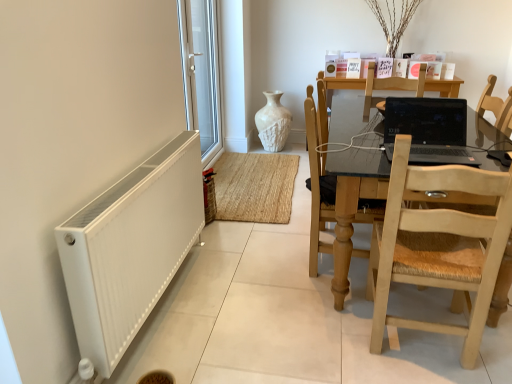
What do you see at coordinates (438, 247) in the screenshot? I see `light wood/rattan chair at right, positioned as the 2th chair in back-to-front order` at bounding box center [438, 247].

What do you see at coordinates (273, 122) in the screenshot?
I see `white textured vase at center` at bounding box center [273, 122].

This screenshot has width=512, height=384. I want to click on black glossy laptop at center, so click(429, 130).

At what (x,y) coordinates should I click in order to perform the action: click on light brown wooden chair at center, arranged as the 2th chair when viewed from the front. Please return your answer as a coordinate pair (x, y). Looking at the image, I should click on (318, 173).

From the image's perspective, is light wood/rattan chair at right, positioned as the 2th chair in back-to-front order, above or below light wood table at right?

light wood/rattan chair at right, positioned as the 2th chair in back-to-front order, is situated lower than light wood table at right in the image.

Consider the image. Considering the sizes of objects light wood/rattan chair at right, the first chair viewed from the front, and light wood table at right in the image provided, who is thinner, light wood/rattan chair at right, the first chair viewed from the front, or light wood table at right?

light wood/rattan chair at right, the first chair viewed from the front.

Could you tell me if light wood/rattan chair at right, the first chair viewed from the front, is facing light wood table at right?

Yes, light wood/rattan chair at right, the first chair viewed from the front, faces towards light wood table at right.

Considering the points (461, 158) and (329, 190), which point is behind, point (461, 158) or point (329, 190)?

The point (329, 190) is farther from the camera.

Would you say black glossy laptop at center contains light brown wooden chair at center, arranged as the 2th chair when viewed from the front?

No, light brown wooden chair at center, arranged as the 2th chair when viewed from the front, is not a part of black glossy laptop at center.

Considering the sizes of objects black glossy laptop at center and light brown wooden chair at center, the first chair from the back, in the image provided, who is shorter, black glossy laptop at center or light brown wooden chair at center, the first chair from the back,?

black glossy laptop at center is shorter.

Is light brown wooden chair at center, arranged as the 2th chair when viewed from the front, at the back of black glossy laptop at center?

black glossy laptop at center does not have its back to light brown wooden chair at center, arranged as the 2th chair when viewed from the front.

Between white textured vase at center and white plastic window at left, which one has larger width?

white textured vase at center.

Which is more to the left, white textured vase at center or white plastic window at left?

Positioned to the left is white plastic window at left.

Between white textured vase at center and white plastic window at left, which one has larger size?

With larger size is white plastic window at left.

Considering the positions of point (268, 120) and point (211, 52), is point (268, 120) closer or farther from the camera than point (211, 52)?

Point (268, 120) appears to be farther away from the viewer than point (211, 52).

Who is shorter, black glossy laptop at center or light wood table at right?

black glossy laptop at center is shorter.

Based on the photo, does black glossy laptop at center turn towards light wood table at right?

No, black glossy laptop at center is not oriented towards light wood table at right.

Between black glossy laptop at center and light wood table at right, which one appears on the left side from the viewer's perspective?

black glossy laptop at center is more to the left.

Is black glossy laptop at center placed right next to light wood table at right?

No.

The image size is (512, 384). In order to click on laptop that is on the right side of white plastic window at left in this screenshot , I will do `click(429, 130)`.

In the scene shown: Choose the correct answer: Is white plastic window at left inside black glossy laptop at center or outside it?

white plastic window at left cannot be found inside black glossy laptop at center.

Can you confirm if white plastic window at left is shorter than black glossy laptop at center?

No.

Could you tell me if white plastic window at left is facing black glossy laptop at center?

No, white plastic window at left is not turned towards black glossy laptop at center.

Can you confirm if light brown wooden chair at center, arranged as the 2th chair when viewed from the front, is shorter than light wood table at right?

No.

Is the surface of light brown wooden chair at center, arranged as the 2th chair when viewed from the front, in direct contact with light wood table at right?

No, light brown wooden chair at center, arranged as the 2th chair when viewed from the front, is not next to light wood table at right.

From a real-world perspective, is light brown wooden chair at center, arranged as the 2th chair when viewed from the front, below light wood table at right?

No, from a real-world perspective, light brown wooden chair at center, arranged as the 2th chair when viewed from the front, is not below light wood table at right.

Can you confirm if white textured vase at center is wider than black glossy laptop at center?

Incorrect, the width of white textured vase at center does not surpass that of black glossy laptop at center.

Can you tell me how much white textured vase at center and black glossy laptop at center differ in facing direction?

2.45 degrees separate the facing orientations of white textured vase at center and black glossy laptop at center.

Between white textured vase at center and black glossy laptop at center, which one appears on the left side from the viewer's perspective?

Positioned to the left is white textured vase at center.

Locate an element on the screen. kitchen & dining room table below the light wood/rattan chair at right, positioned as the 2th chair in back-to-front order (from a real-world perspective) is located at coordinates (351, 207).

Find the location of a particular element. The image size is (512, 384). chair behind the black glossy laptop at center is located at coordinates (318, 173).

Estimate the real-world distances between objects in this image. Which object is closer to white textured vase at center, black glossy laptop at center or light wood/rattan chair at right, positioned as the 2th chair in back-to-front order?

black glossy laptop at center lies closer to white textured vase at center than the other object.

From the image, which object appears to be farther from white plastic window at left, light wood/rattan chair at right, the first chair viewed from the front, or black glossy laptop at center?

light wood/rattan chair at right, the first chair viewed from the front, lies further to white plastic window at left than the other object.

From the image, which object appears to be farther from light brown wooden chair at center, the first chair from the back, white matte radiator at lower left or white plastic window at left?

Based on the image, white plastic window at left appears to be further to light brown wooden chair at center, the first chair from the back.

In the scene shown: When comparing their distances from light wood/rattan chair at right, positioned as the 2th chair in back-to-front order, does black glossy laptop at center or white plastic window at left seem further?

The object further to light wood/rattan chair at right, positioned as the 2th chair in back-to-front order, is white plastic window at left.

When comparing their distances from light wood table at right, does white textured vase at center or light brown wooden chair at center, arranged as the 2th chair when viewed from the front, seem closer?

Based on the image, light brown wooden chair at center, arranged as the 2th chair when viewed from the front, appears to be nearer to light wood table at right.

Considering their positions, is light wood/rattan chair at right, the first chair viewed from the front, positioned closer to white textured vase at center than black glossy laptop at center?

Based on the image, black glossy laptop at center appears to be nearer to white textured vase at center.

Which object lies nearer to the anchor point white textured vase at center, white matte radiator at lower left or black glossy laptop at center?

The object closer to white textured vase at center is black glossy laptop at center.

Considering their positions, is white matte radiator at lower left positioned closer to light brown wooden chair at center, the first chair from the back, than light wood table at right?

The object closer to light brown wooden chair at center, the first chair from the back, is light wood table at right.

Image resolution: width=512 pixels, height=384 pixels. I want to click on chair between light wood table at right and white plastic window at left along the z-axis, so click(318, 173).

The image size is (512, 384). I want to click on kitchen & dining room table positioned between white matte radiator at lower left and white plastic window at left from near to far, so coord(351,207).

You are a GUI agent. You are given a task and a screenshot of the screen. Output one action in this format:
    pyautogui.click(x=<x>, y=<y>)
    Task: Click on the window screen positioned between light wood/rattan chair at right, positioned as the 2th chair in back-to-front order, and white textured vase at center from near to far
    Image resolution: width=512 pixels, height=384 pixels.
    Given the screenshot: What is the action you would take?
    pyautogui.click(x=201, y=72)

The width and height of the screenshot is (512, 384). What are the coordinates of `chair between light wood/rattan chair at right, the first chair viewed from the front, and white plastic window at left in the front-back direction` in the screenshot? It's located at (318, 173).